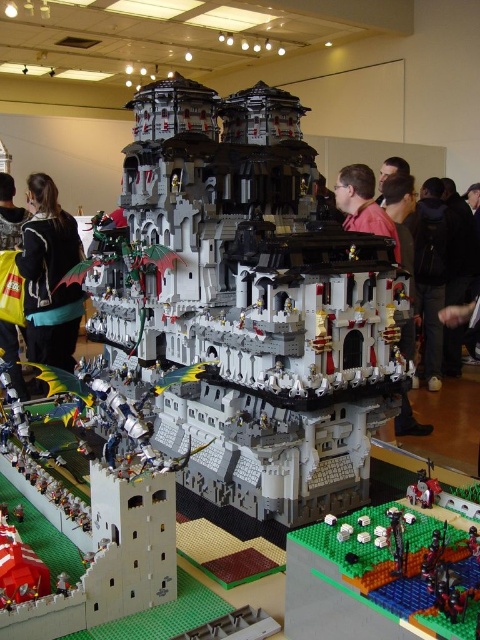
Question: Which of these objects is positioned farthest from the yellow fabric bag at lower left?

Choices:
 (A) black fabric jacket at left
 (B) white matte castle at center

Answer: (B)

Question: Which point is closer to the camera taking this photo?

Choices:
 (A) (11, 360)
 (B) (255, 305)
 (C) (54, 186)

Answer: (B)

Question: From the image, what is the correct spatial relationship of white matte castle at center in relation to yellow fabric bag at lower left?

Choices:
 (A) left
 (B) right

Answer: (B)

Question: Does white matte castle at center have a smaller size compared to yellow fabric bag at lower left?

Choices:
 (A) no
 (B) yes

Answer: (A)

Question: Which object is positioned closest to the black fabric jacket at left?

Choices:
 (A) yellow fabric bag at lower left
 (B) white matte castle at center

Answer: (A)

Question: Where is white matte castle at center located in relation to black fabric jacket at left in the image?

Choices:
 (A) above
 (B) below

Answer: (B)